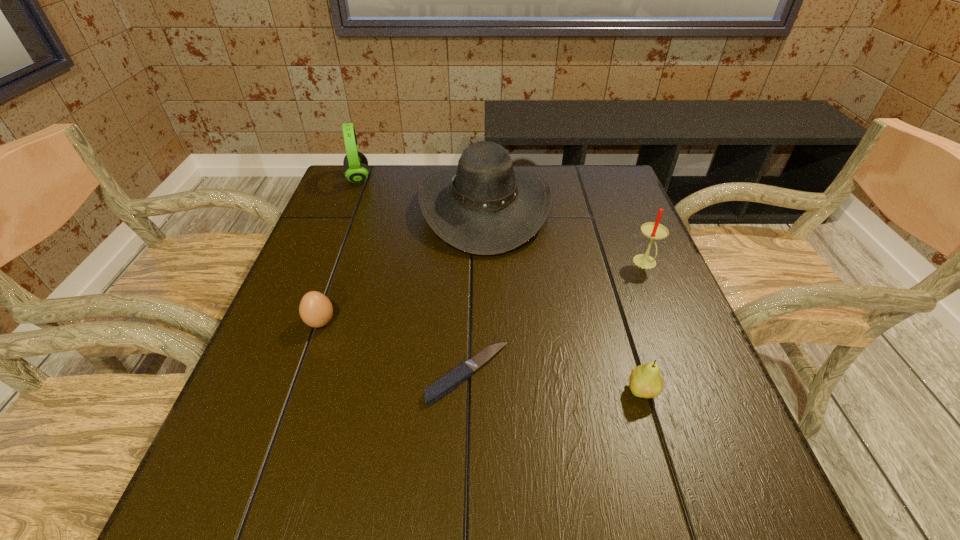
Where is `unoccupied position between the pear and the headset`? This screenshot has height=540, width=960. unoccupied position between the pear and the headset is located at coordinates (500, 285).

You are a GUI agent. You are given a task and a screenshot of the screen. Output one action in this format:
    pyautogui.click(x=<x>, y=<y>)
    Task: Click on the vacant space in between the rightmost object and the third nearest object
    The width and height of the screenshot is (960, 540).
    Given the screenshot: What is the action you would take?
    pyautogui.click(x=483, y=293)

Identify the location of unoccupied position between the shortest object and the pear. (555, 383).

I want to click on the fourth closest object relative to the fourth farthest object, so click(x=645, y=381).

Point out which object is positioned as the second nearest to the rightmost object. Please provide its 2D coordinates. Your answer should be formatted as a tuple, i.e. [(x, y)], where the tuple contains the x and y coordinates of a point satisfying the conditions above.

[(645, 381)]

The width and height of the screenshot is (960, 540). I want to click on vacant space that satisfies the following two spatial constraints: 1. on the front side of the shortest object; 2. on the right side of the headset, so click(282, 374).

Image resolution: width=960 pixels, height=540 pixels. What are the coordinates of `free space that satisfies the following two spatial constraints: 1. on the front-facing side of the cowboy hat; 2. on the back side of the pear` in the screenshot? It's located at (488, 392).

Identify the location of blank area in the image that satisfies the following two spatial constraints: 1. on the front-facing side of the pear; 2. on the right side of the cowboy hat. The height and width of the screenshot is (540, 960). (488, 392).

Locate an element on the screen. vacant space that satisfies the following two spatial constraints: 1. on the back side of the rightmost object; 2. on the front-facing side of the cowboy hat is located at coordinates (622, 208).

Where is `free point that satisfies the following two spatial constraints: 1. on the front-facing side of the cowboy hat; 2. on the right side of the candle`? free point that satisfies the following two spatial constraints: 1. on the front-facing side of the cowboy hat; 2. on the right side of the candle is located at coordinates (486, 264).